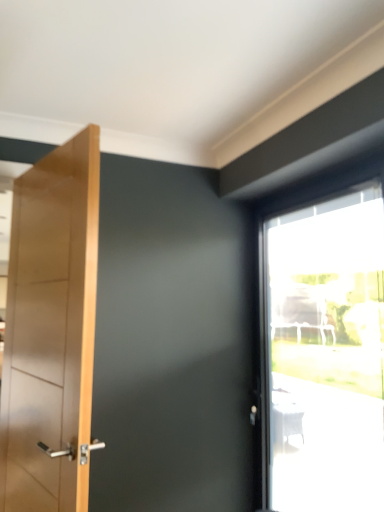
Question: Does transparent glass window at upper right have a lesser width compared to light brown wooden door at left?

Choices:
 (A) yes
 (B) no

Answer: (B)

Question: Is transparent glass window at upper right further to the viewer compared to light brown wooden door at left?

Choices:
 (A) yes
 (B) no

Answer: (A)

Question: Is light brown wooden door at left a part of transparent glass window at upper right?

Choices:
 (A) no
 (B) yes

Answer: (A)

Question: Does transparent glass window at upper right have a smaller size compared to light brown wooden door at left?

Choices:
 (A) yes
 (B) no

Answer: (B)

Question: From the image's perspective, is transparent glass window at upper right above light brown wooden door at left?

Choices:
 (A) yes
 (B) no

Answer: (B)

Question: Can you confirm if transparent glass window at upper right is wider than light brown wooden door at left?

Choices:
 (A) no
 (B) yes

Answer: (B)

Question: From the image's perspective, does light brown wooden door at left appear higher than transparent glass window at upper right?

Choices:
 (A) no
 (B) yes

Answer: (B)

Question: Does light brown wooden door at left have a lesser height compared to transparent glass window at upper right?

Choices:
 (A) no
 (B) yes

Answer: (B)

Question: From a real-world perspective, is light brown wooden door at left on transparent glass window at upper right?

Choices:
 (A) yes
 (B) no

Answer: (A)

Question: Is light brown wooden door at left to the left of transparent glass window at upper right from the viewer's perspective?

Choices:
 (A) yes
 (B) no

Answer: (A)

Question: Is light brown wooden door at left closer to the viewer compared to transparent glass window at upper right?

Choices:
 (A) yes
 (B) no

Answer: (A)

Question: Would you say light brown wooden door at left is outside transparent glass window at upper right?

Choices:
 (A) no
 (B) yes

Answer: (B)

Question: From their relative heights in the image, would you say transparent glass window at upper right is taller or shorter than light brown wooden door at left?

Choices:
 (A) tall
 (B) short

Answer: (A)